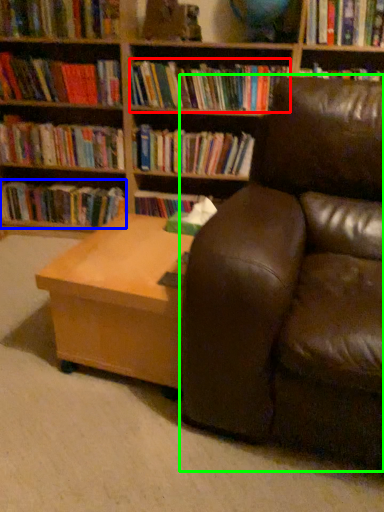
Question: Estimate the real-world distances between objects in this image. Which object is farther from book (highlighted by a red box), book (highlighted by a blue box) or studio couch (highlighted by a green box)?

Choices:
 (A) book
 (B) studio couch

Answer: (B)